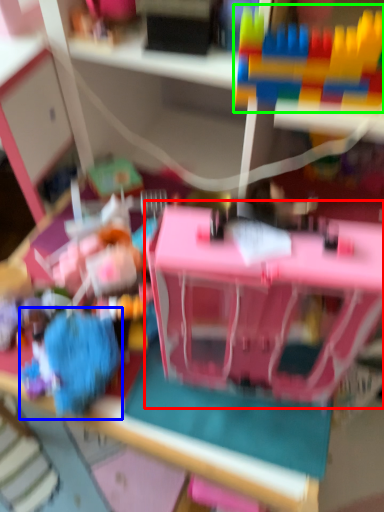
Question: Which is nearer to the toy (highlighted by a red box)? toy (highlighted by a blue box) or toy (highlighted by a green box).

Choices:
 (A) toy
 (B) toy

Answer: (A)